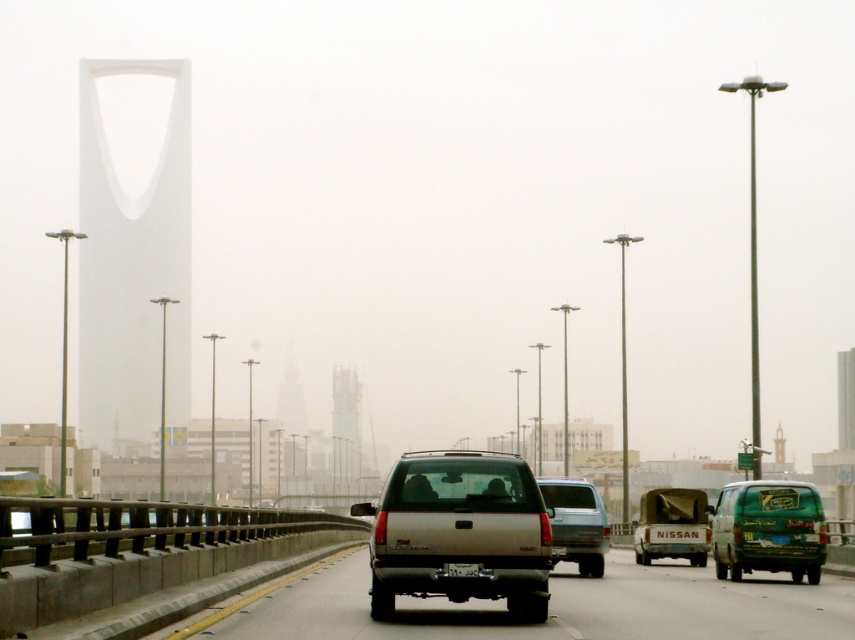
Between satin silver suv at center and matte silver truck at center, which one is positioned higher?

satin silver suv at center

Can you confirm if satin silver suv at center is taller than matte silver truck at center?

Correct, satin silver suv at center is much taller as matte silver truck at center.

This screenshot has width=855, height=640. What are the coordinates of `satin silver suv at center` in the screenshot? It's located at (458, 531).

I want to click on satin silver suv at center, so click(458, 531).

Does matte silver truck at center appear over black plastic license plate at center?

No.

How distant is matte silver truck at center from black plastic license plate at center?

matte silver truck at center and black plastic license plate at center are 69.85 feet apart from each other.

Which is behind, point (659, 513) or point (447, 570)?

Positioned behind is point (659, 513).

The image size is (855, 640). I want to click on matte silver truck at center, so click(671, 525).

Is the position of matte silver suv at center more distant than that of black plastic license plate at center?

Yes, it is.

Is point (575, 536) positioned before point (453, 570)?

No, it is not.

Between point (581, 525) and point (458, 573), which one is positioned in front?

Point (458, 573)

Image resolution: width=855 pixels, height=640 pixels. I want to click on matte silver suv at center, so click(576, 524).